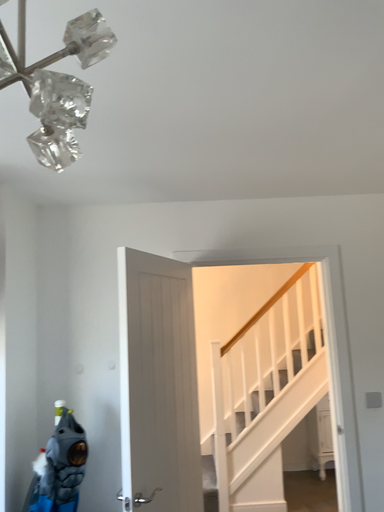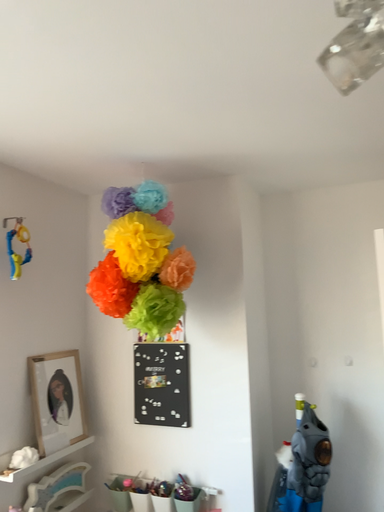
Question: How did the camera likely rotate when shooting the video?

Choices:
 (A) rotated right
 (B) rotated left

Answer: (B)